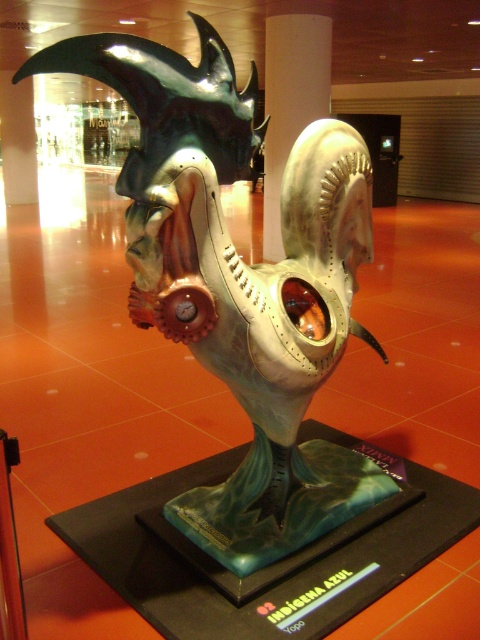
Looking at this image, between metallic/textured mask at center and metallic gold at center, which one appears on the left side from the viewer's perspective?

Positioned to the left is metallic/textured mask at center.

What do you see at coordinates (240, 282) in the screenshot? The image size is (480, 640). I see `metallic/textured mask at center` at bounding box center [240, 282].

Is point (203, 19) farther from viewer compared to point (275, 116)?

No.

Where is `metallic/textured mask at center`? This screenshot has width=480, height=640. metallic/textured mask at center is located at coordinates (240, 282).